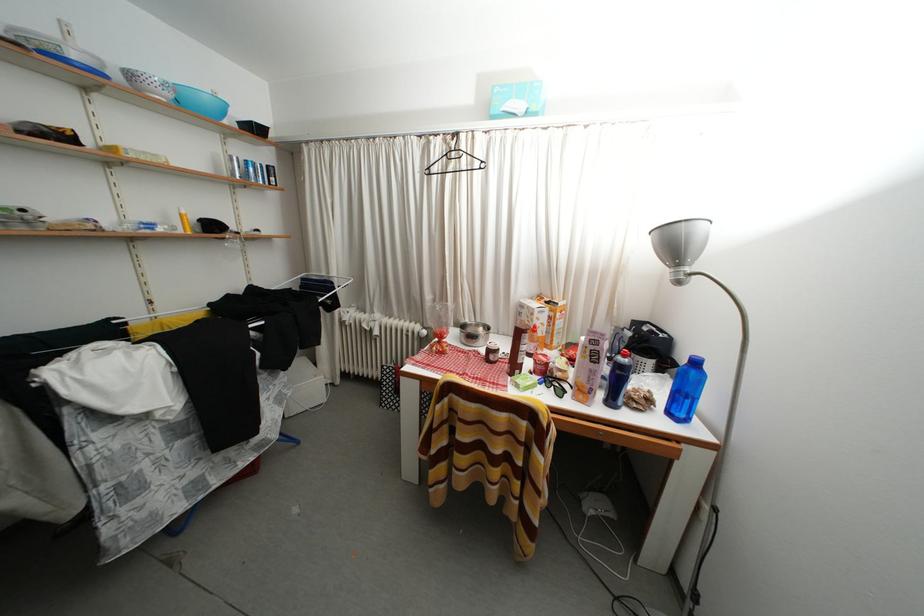
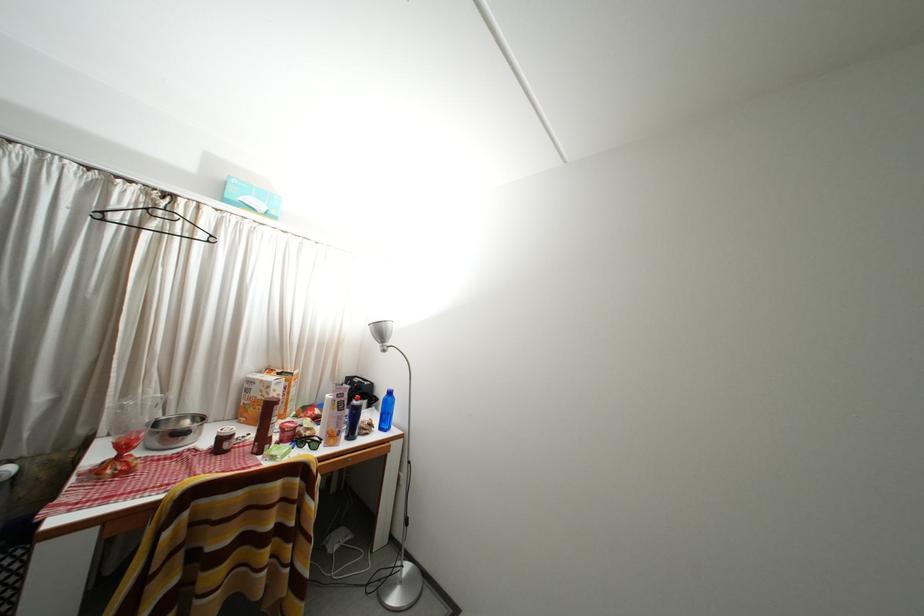
Where in the second image is the point corresponding to [528,111] from the first image?

(268, 211)